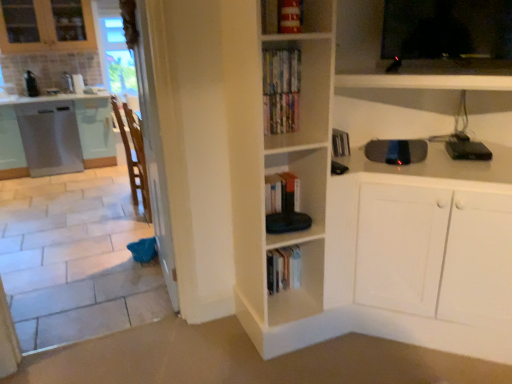
Question: Is black plastic skateboard at upper right, which ranks as the first appliance in bottom-to-top order, closer to the viewer compared to black glossy tv at upper right?

Choices:
 (A) no
 (B) yes

Answer: (A)

Question: Could you tell me if black plastic skateboard at upper right, marked as the 2th appliance in a left-to-right arrangement, is facing black glossy tv at upper right?

Choices:
 (A) yes
 (B) no

Answer: (B)

Question: Is black plastic skateboard at upper right, which appears as the 1th appliance when viewed from the front, not inside black glossy tv at upper right?

Choices:
 (A) yes
 (B) no

Answer: (A)

Question: From a real-world perspective, is black plastic skateboard at upper right, marked as the 2th appliance in a left-to-right arrangement, under black glossy tv at upper right?

Choices:
 (A) yes
 (B) no

Answer: (A)

Question: From a real-world perspective, does black plastic skateboard at upper right, the 3th appliance when ordered from top to bottom, stand above black glossy tv at upper right?

Choices:
 (A) yes
 (B) no

Answer: (B)

Question: From a real-world perspective, is white tile at left above or below brushed metal toaster at left, which ranks as the third appliance in right-to-left order?

Choices:
 (A) below
 (B) above

Answer: (A)

Question: In terms of height, does white tile at left look taller or shorter compared to brushed metal toaster at left, arranged as the first appliance when viewed from the back?

Choices:
 (A) tall
 (B) short

Answer: (B)

Question: Considering the relative positions of white tile at left and brushed metal toaster at left, the 1th appliance from the left, in the image provided, is white tile at left to the left or to the right of brushed metal toaster at left, the 1th appliance from the left,?

Choices:
 (A) right
 (B) left

Answer: (A)

Question: Is point (38, 329) closer or farther from the camera than point (37, 94)?

Choices:
 (A) closer
 (B) farther

Answer: (A)

Question: From the image's perspective, is brushed metal toaster at left, arranged as the 1th appliance when viewed from the top, positioned above or below hardcover books at upper center?

Choices:
 (A) above
 (B) below

Answer: (A)

Question: Is point (24, 74) positioned closer to the camera than point (287, 76)?

Choices:
 (A) closer
 (B) farther

Answer: (B)

Question: Relative to hardcover books at upper center, is brushed metal toaster at left, the third appliance when ordered from bottom to top, in front or behind?

Choices:
 (A) front
 (B) behind

Answer: (B)

Question: From a real-world perspective, is brushed metal toaster at left, which is the third appliance from front to back, above or below hardcover books at upper center?

Choices:
 (A) above
 (B) below

Answer: (B)

Question: Choose the correct answer: Is black glossy tv at upper right inside hardcover books at upper center or outside it?

Choices:
 (A) outside
 (B) inside

Answer: (A)

Question: In terms of width, does black glossy tv at upper right look wider or thinner when compared to hardcover books at upper center?

Choices:
 (A) wide
 (B) thin

Answer: (A)